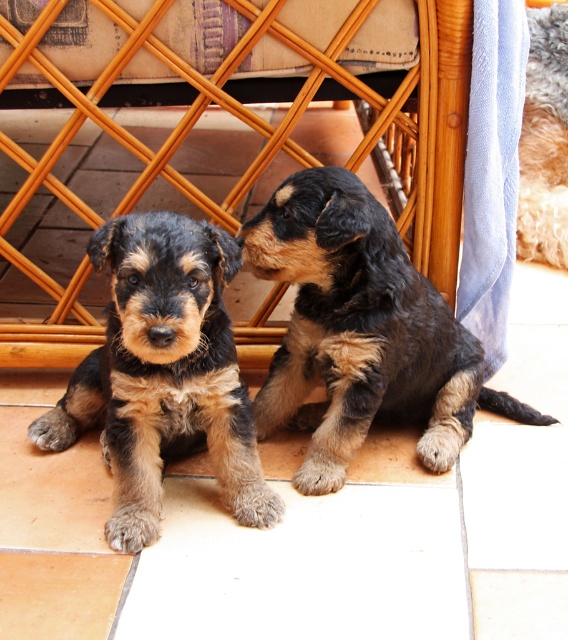
You are a dog breeder observing two puppies in a room. You see the brown fur puppy at center and the fuzzy brown fur at center. Which puppy has a greater width?

The brown fur puppy at center has a greater width than the fuzzy brown fur at center.

You are a dog trainer observing two puppies in a room. You see a brown fur puppy at center and a fuzzy brown fur at center. Which puppy is positioned to the left?

The brown fur puppy at center is to the left of fuzzy brown fur at center, so the brown fur puppy at center is positioned to the left.

You are a photographer setting up a shoot in the scene described. You want to position a small reflector to bounce light onto the fuzzy brown fur at center without it being visible in the frame. Given the position of the woven wood chair at center, where should you place the reflector?

The woven wood chair at center is located below the fuzzy brown fur at center, so placing the reflector below the chair would position it under the fur, bouncing light upwards without being visible in the frame.